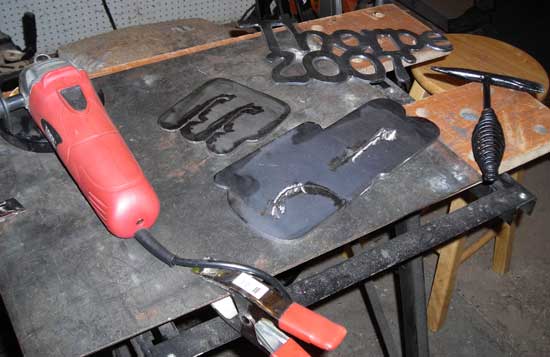
The image size is (550, 357). Find the location of `black wire`. black wire is located at coordinates (175, 257).